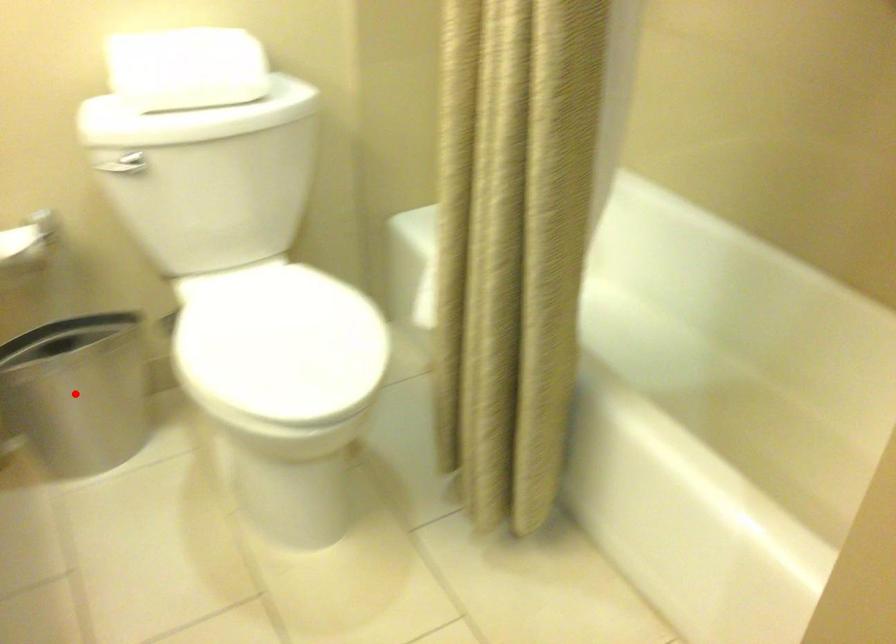
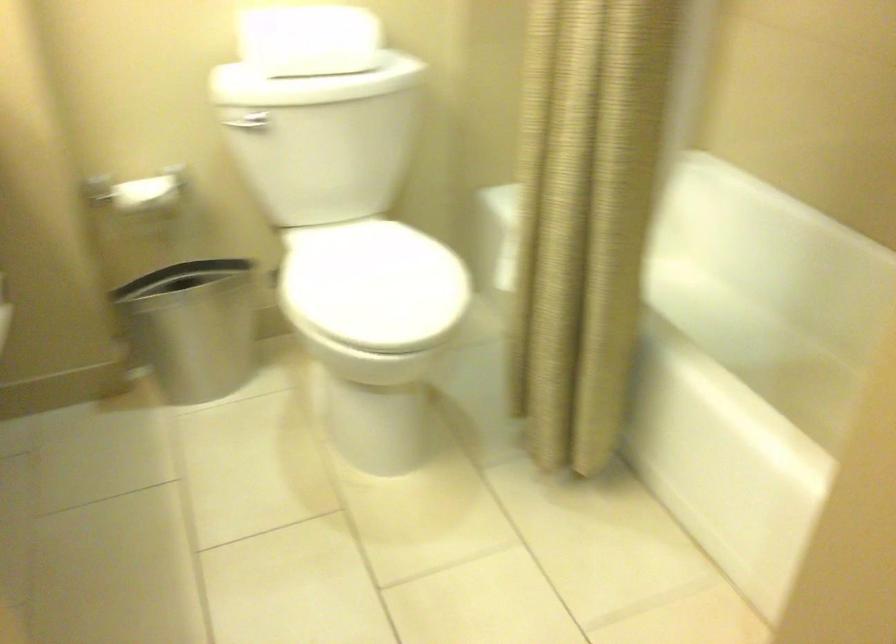
Question: I am providing you with two images of the same scene from different viewpoints. Given a red point in image1, look at the same physical point in image2. Is it:

Choices:
 (A) Closer to the viewpoint
 (B) Farther from the viewpoint

Answer: (B)